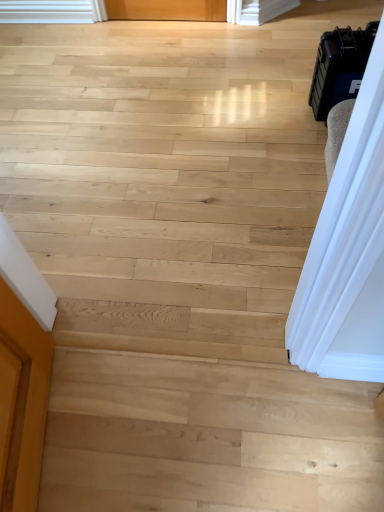
This screenshot has width=384, height=512. What are the coordinates of `free space above natural wood stairwell at lower left (from a real-world perspective)` in the screenshot? It's located at (209, 437).